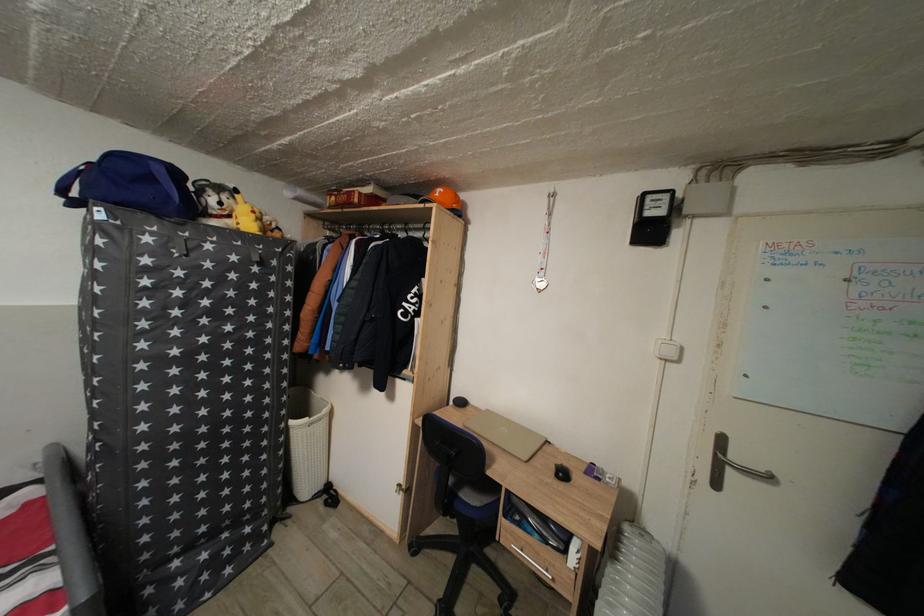
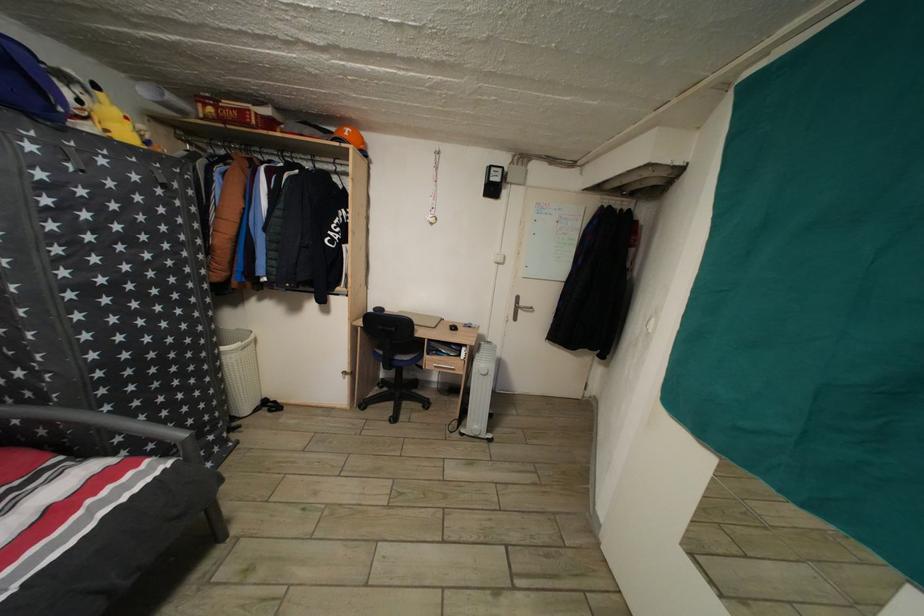
Find the pixel in the second image that matches the point at 362,207 in the first image.

(261, 129)